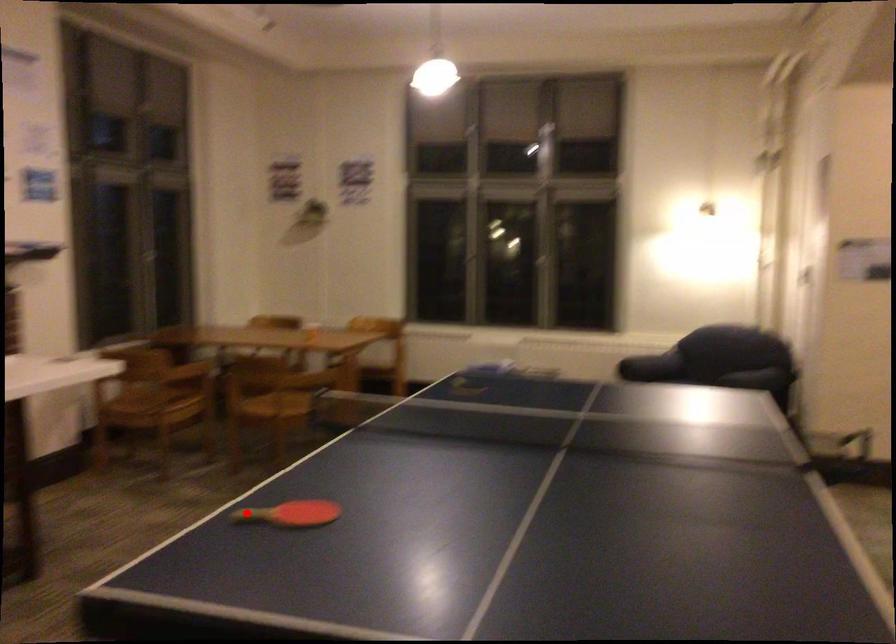
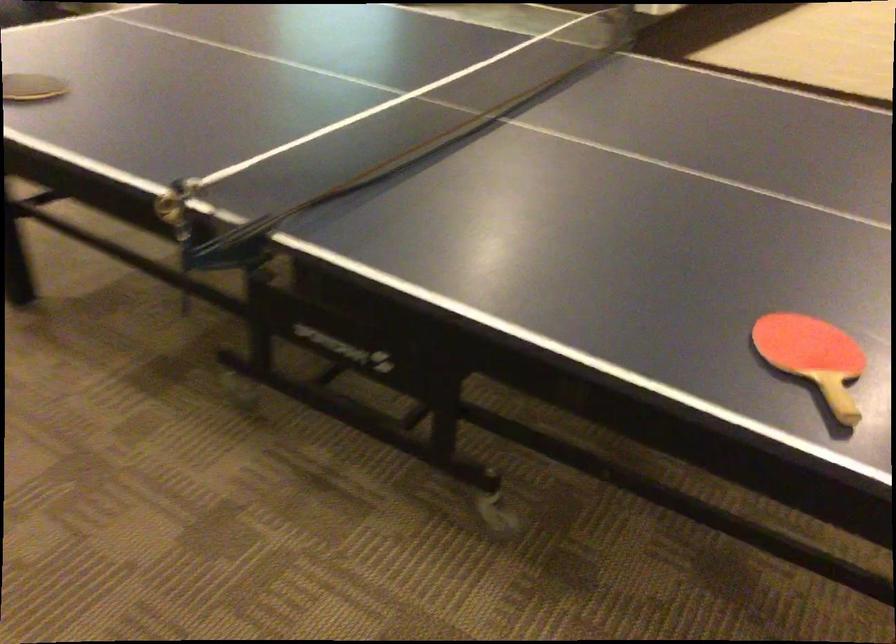
In the second image, find the point that corresponds to the highlighted location in the first image.

(813, 357)